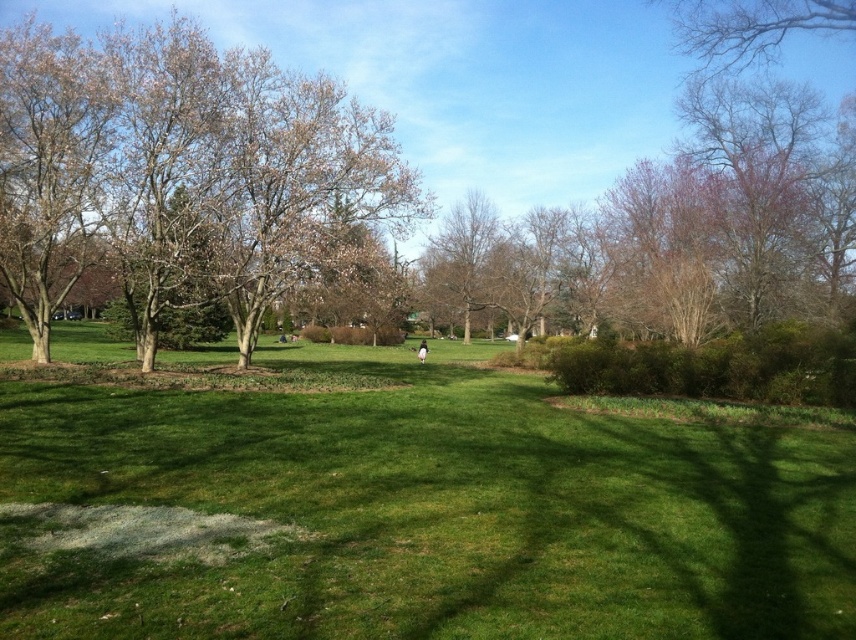
From the picture: You are standing in the park and see the green grass at center and the bare branches at left. Which object is positioned to the right of the other?

The green grass at center is to the right of the bare branches at left.

You are standing at the point labeled as point (x=428, y=512) in the park. What is the immediate surface you are standing on?

The immediate surface at point (x=428, y=512) is green grass at center.